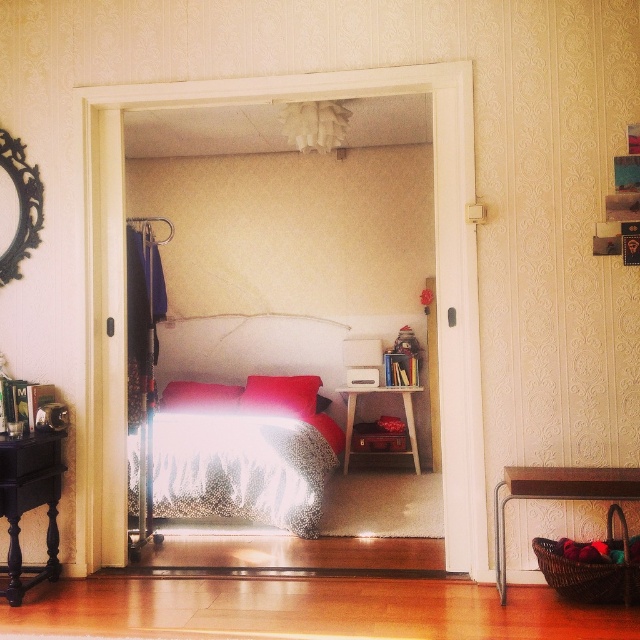
What is the spatial relationship between the patterned fabric bed at center and the black ornate mirror at upper left in the bedroom scene?

The patterned fabric bed at center is to the right of the black ornate mirror at upper left.

Looking at this image, you are standing in the doorway of the bedroom and want to pick up the woven wicker basket at lower right. Which direction should you move relative to the velvet red pillow at center?

The woven wicker basket at lower right is to the right of the velvet red pillow at center, so you should move to the right of the velvet red pillow at center to reach it.